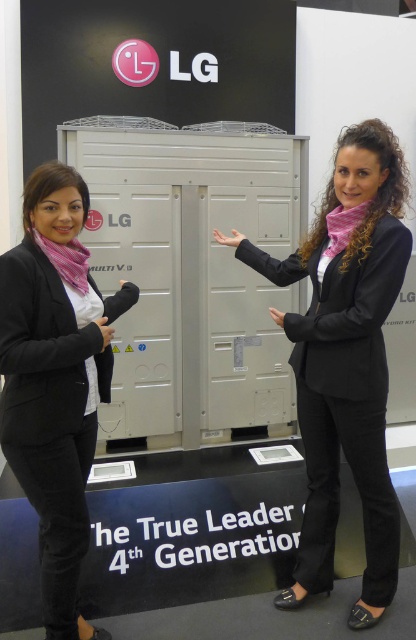
Consider the image. Does black smooth suit at center appear on the right side of matte black hand at center?

Indeed, black smooth suit at center is positioned on the right side of matte black hand at center.

Does point (287, 275) come behind point (279, 314)?

Yes, point (287, 275) is behind point (279, 314).

What do you see at coordinates (344, 397) in the screenshot? I see `black smooth suit at center` at bounding box center [344, 397].

Find the location of a particular element. The height and width of the screenshot is (640, 416). black smooth suit at center is located at coordinates (344, 397).

Can you confirm if matte black blazer at left is shorter than black smooth suit at center?

No, matte black blazer at left is not shorter than black smooth suit at center.

Which is in front, point (79, 449) or point (321, 502)?

Positioned in front is point (79, 449).

You are a GUI agent. You are given a task and a screenshot of the screen. Output one action in this format:
    pyautogui.click(x=<x>, y=<y>)
    Task: Click on the matte black blazer at left
    
    Given the screenshot: What is the action you would take?
    pyautogui.click(x=54, y=380)

Is matte black blazer at left below black leather hand at center?

Correct, matte black blazer at left is located below black leather hand at center.

Between matte black blazer at left and black leather hand at center, which one has less height?

black leather hand at center is shorter.

Does point (7, 451) come behind point (111, 333)?

That is False.

Image resolution: width=416 pixels, height=640 pixels. Identify the location of matte black blazer at left. pyautogui.click(x=54, y=380).